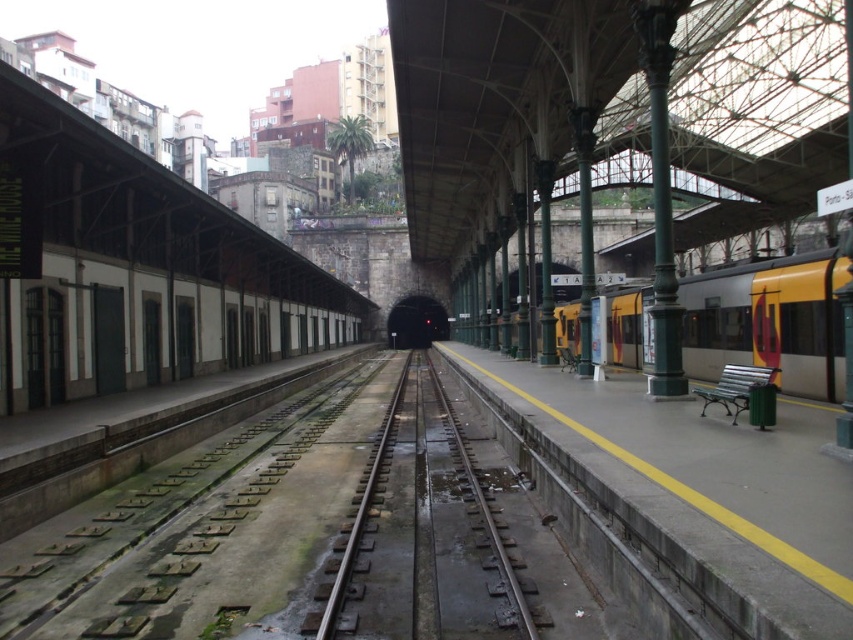
Question: Which object is the farthest from the concrete platform at center?

Choices:
 (A) smooth concrete train track at center
 (B) yellow metallic train at right

Answer: (B)

Question: Which object is the closest to the smooth concrete train track at center?

Choices:
 (A) concrete platform at center
 (B) yellow metallic train at right

Answer: (A)

Question: Which of the following is the farthest from the observer?

Choices:
 (A) yellow metallic train at right
 (B) smooth concrete train track at center
 (C) concrete platform at center

Answer: (A)

Question: Does yellow metallic train at right have a smaller size compared to smooth concrete train track at center?

Choices:
 (A) no
 (B) yes

Answer: (A)

Question: Can you confirm if yellow metallic train at right is wider than smooth concrete train track at center?

Choices:
 (A) no
 (B) yes

Answer: (B)

Question: Does concrete platform at center appear under smooth concrete train track at center?

Choices:
 (A) no
 (B) yes

Answer: (A)